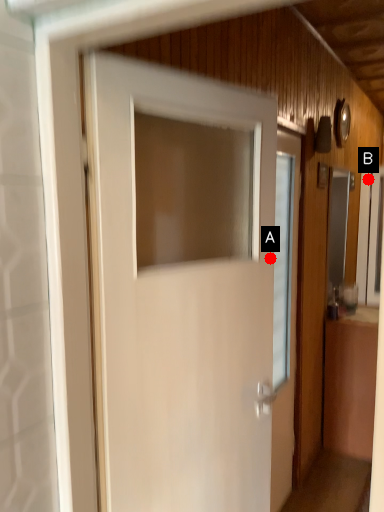
Question: Two points are circled on the image, labeled by A and B beside each circle. Which point appears closest to the camera in this image?

Choices:
 (A) A is closer
 (B) B is closer

Answer: (A)